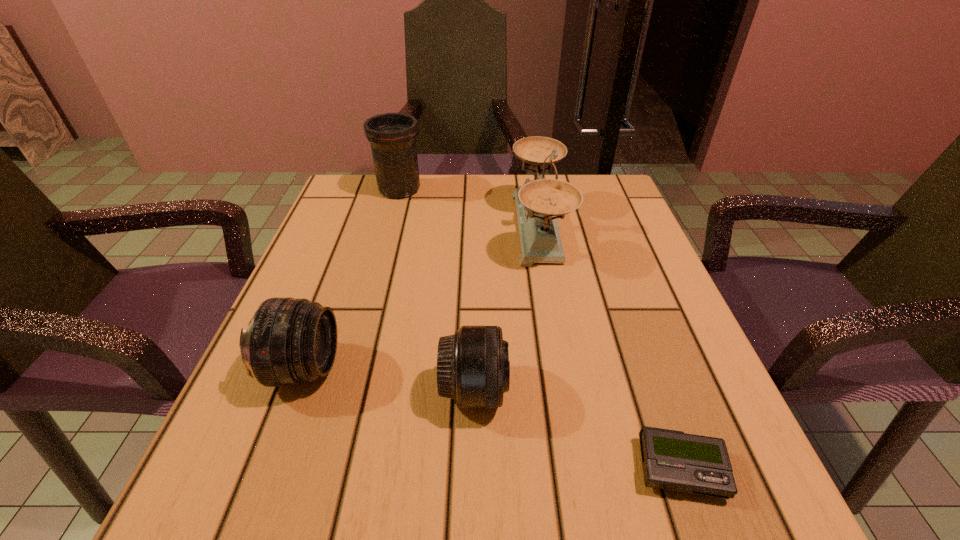
The height and width of the screenshot is (540, 960). In order to click on free space at the far left corner in this screenshot , I will do `click(366, 179)`.

Find the location of `free space at the far right corner`. free space at the far right corner is located at coordinates (585, 214).

This screenshot has height=540, width=960. In order to click on empty space between the nearest object and the third object from left to right in this screenshot , I will do `click(577, 429)`.

Where is `empty space between the third object from right to left and the scale`? This screenshot has width=960, height=540. empty space between the third object from right to left and the scale is located at coordinates (507, 309).

Where is `free space between the shortest object and the tallest telephoto lens`? The image size is (960, 540). free space between the shortest object and the tallest telephoto lens is located at coordinates (540, 329).

Locate an element on the screen. free area in between the tallest telephoto lens and the scale is located at coordinates (469, 208).

Image resolution: width=960 pixels, height=540 pixels. I want to click on free spot between the nearest object and the rightmost telephoto lens, so click(577, 429).

Identify which object is located as the nearest to the farthest telephoto lens. Please provide its 2D coordinates. Your answer should be formatted as a tuple, i.e. [(x, y)], where the tuple contains the x and y coordinates of a point satisfying the conditions above.

[(539, 203)]

Image resolution: width=960 pixels, height=540 pixels. What are the coordinates of `object that is the second closest to the fourth object from left to right` in the screenshot? It's located at (473, 368).

At what (x,y) coordinates should I click in order to perform the action: click on telephoto lens that can be found as the second closest to the beeper. Please return your answer as a coordinate pair (x, y). The width and height of the screenshot is (960, 540). Looking at the image, I should click on tap(289, 341).